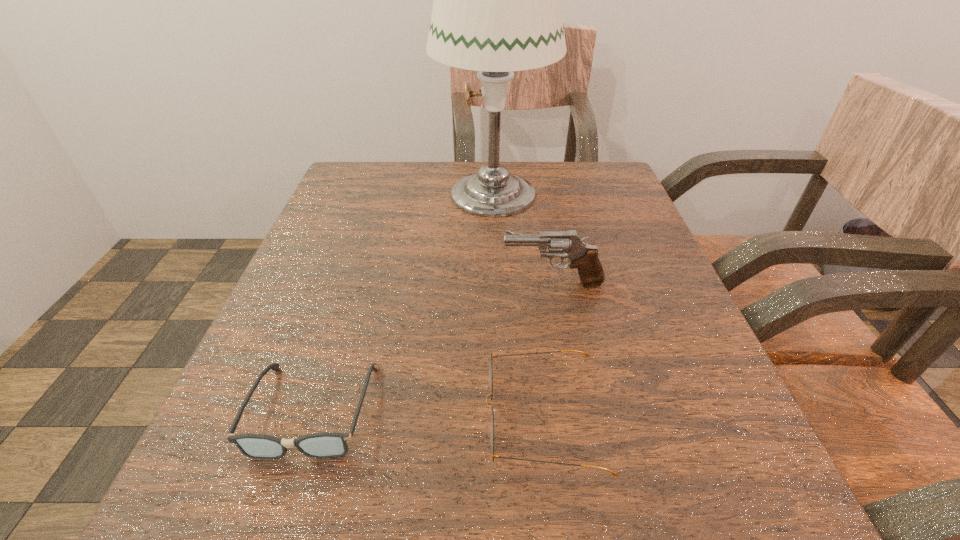
You are a GUI agent. You are given a task and a screenshot of the screen. Output one action in this format:
    pyautogui.click(x=<x>, y=<y>)
    Task: Click on the vacant area situated 0.180m on the lampshade of the lampshade
    This screenshot has height=540, width=960.
    Given the screenshot: What is the action you would take?
    pyautogui.click(x=356, y=193)

Where is `vacant space located 0.310m at the barrel of the pistol`? vacant space located 0.310m at the barrel of the pistol is located at coordinates (322, 284).

Locate an element on the screen. The width and height of the screenshot is (960, 540). vacant area situated 0.080m at the barrel of the pistol is located at coordinates (456, 284).

Find the location of a particular element. Image resolution: width=960 pixels, height=540 pixels. vacant space located at the barrel of the pistol is located at coordinates (397, 284).

The height and width of the screenshot is (540, 960). I want to click on free space located 0.170m on the temples of the second shortest object, so click(x=352, y=417).

You are a GUI agent. You are given a task and a screenshot of the screen. Output one action in this format:
    pyautogui.click(x=<x>, y=<y>)
    Task: Click on the vacant space located on the temples of the second shortest object
    The image size is (960, 540).
    Given the screenshot: What is the action you would take?
    pyautogui.click(x=243, y=417)

Find the location of a particular element. This screenshot has width=960, height=540. free space located 0.340m on the temples of the second shortest object is located at coordinates [x=220, y=417].

Where is `vacant space positioned 0.060m on the face of the shorter spectacles`? vacant space positioned 0.060m on the face of the shorter spectacles is located at coordinates (278, 517).

Locate an element on the screen. The width and height of the screenshot is (960, 540). object that is positioned at the far edge is located at coordinates (497, 9).

Locate an element on the screen. Image resolution: width=960 pixels, height=540 pixels. object that is at the left edge is located at coordinates (321, 445).